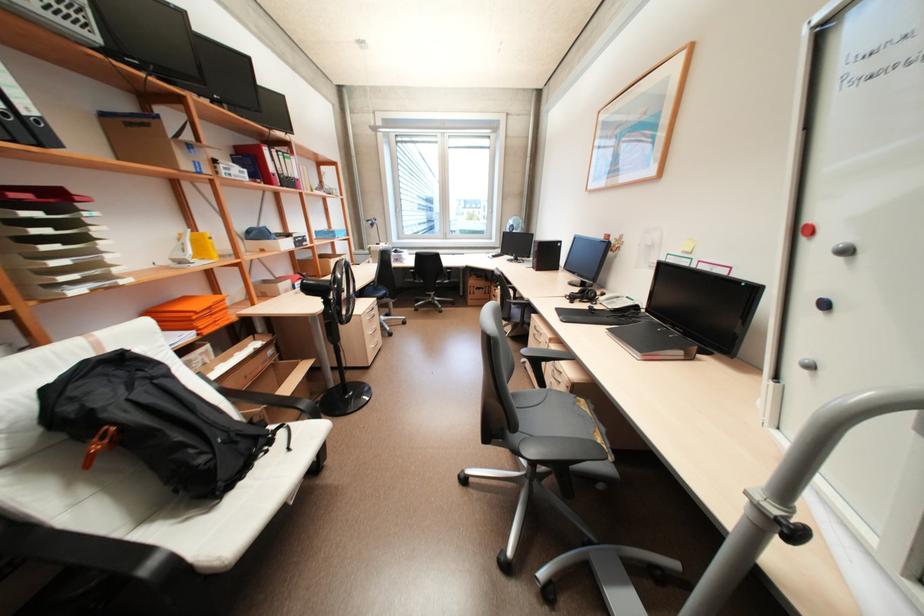
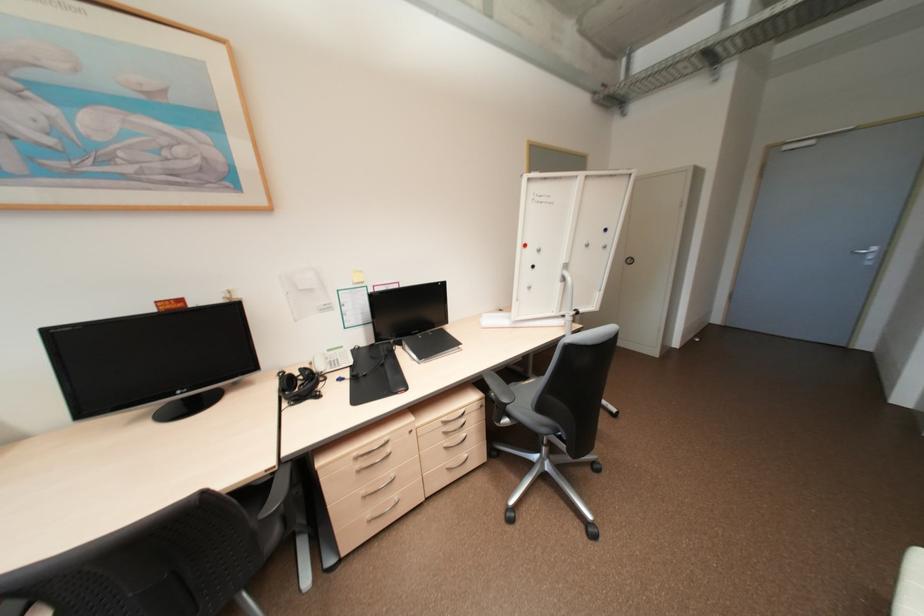
Find the pixel in the second image that matches point (830, 304) in the first image.

(539, 265)